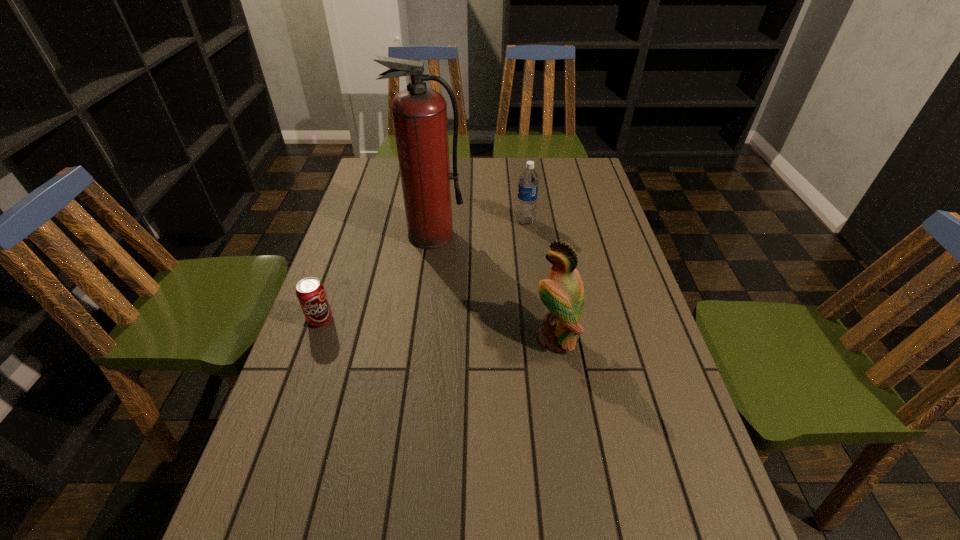
Where is `vacant region located 0.070m on the back of the water bottle`? vacant region located 0.070m on the back of the water bottle is located at coordinates pyautogui.click(x=523, y=204).

You are a GUI agent. You are given a task and a screenshot of the screen. Output one action in this format:
    pyautogui.click(x=<x>, y=<y>)
    Task: Click on the blank space located on the back of the leftmost object
    
    Given the screenshot: What is the action you would take?
    pyautogui.click(x=353, y=225)

Locate an element on the screen. object at the left edge is located at coordinates (310, 292).

Where is `vacant space at the far edge`? vacant space at the far edge is located at coordinates (499, 183).

The width and height of the screenshot is (960, 540). Find the location of `vacant space at the left edge of the desktop`. vacant space at the left edge of the desktop is located at coordinates (329, 435).

Identify the location of vacant region at the right edge. The width and height of the screenshot is (960, 540). (641, 468).

Identify the location of free point at the far left corner. The height and width of the screenshot is (540, 960). (387, 158).

This screenshot has width=960, height=540. In the image, there is a desktop. Identify the location of free space at the far right corner. (576, 187).

Image resolution: width=960 pixels, height=540 pixels. I want to click on free spot between the third tallest object and the shortest object, so click(x=423, y=271).

Locate an element on the screen. Image resolution: width=960 pixels, height=540 pixels. vacant space that is in between the parrot and the soda is located at coordinates (438, 329).